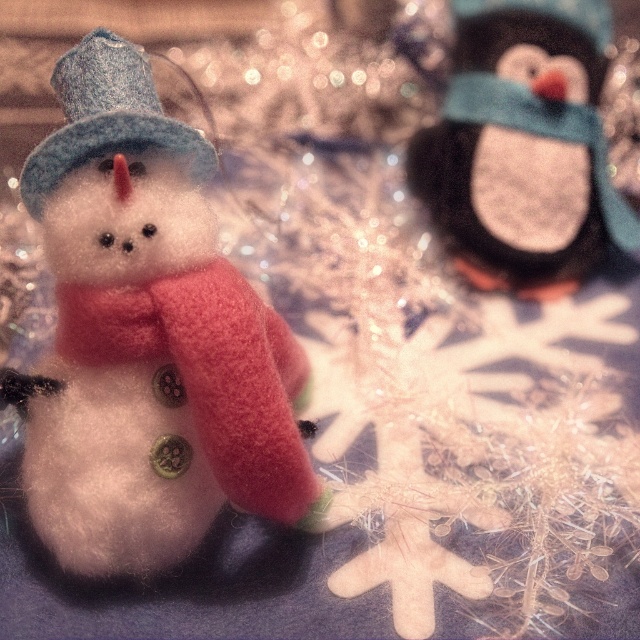
Where is `felt penguin at upper right`? felt penguin at upper right is located at coordinates (524, 147).

Which is more to the left, felt penguin at upper right or felt blue hat at left?

Positioned to the left is felt blue hat at left.

Is point (561, 10) less distant than point (113, 93)?

No, it is not.

The image size is (640, 640). I want to click on felt penguin at upper right, so (x=524, y=147).

Which is behind, point (272, 348) or point (449, 168)?

Point (449, 168)

Who is positioned more to the left, felt snowman at left or felt penguin at upper right?

felt snowman at left is more to the left.

This screenshot has width=640, height=640. What do you see at coordinates (147, 339) in the screenshot?
I see `felt snowman at left` at bounding box center [147, 339].

Where is `felt snowman at left`? Image resolution: width=640 pixels, height=640 pixels. felt snowman at left is located at coordinates (147, 339).

Between felt snowman at left and felt blue hat at left, which one is positioned lower?

felt snowman at left

What are the coordinates of `felt snowman at left` in the screenshot? It's located at (147, 339).

Is point (168, 429) behind point (54, 70)?

No, it is in front of (54, 70).

Where is `felt snowman at left`? This screenshot has height=640, width=640. felt snowman at left is located at coordinates (147, 339).